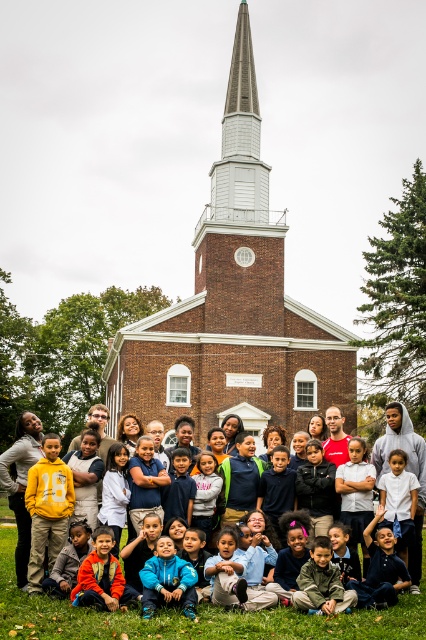
Question: Which object is closer to the camera taking this photo?

Choices:
 (A) brown brick chapel at center
 (B) matte yellow hoodie at center

Answer: (B)

Question: From the image, what is the correct spatial relationship of brown brick chapel at center in relation to matte yellow hoodie at center?

Choices:
 (A) right
 (B) left

Answer: (A)

Question: Does brown brick chapel at center have a greater width compared to matte yellow hoodie at center?

Choices:
 (A) yes
 (B) no

Answer: (B)

Question: Is brown brick chapel at center wider than matte yellow hoodie at center?

Choices:
 (A) no
 (B) yes

Answer: (A)

Question: Among these points, which one is farthest from the camera?

Choices:
 (A) (233, 278)
 (B) (5, 598)

Answer: (A)

Question: Which of the following is the closest to the observer?

Choices:
 (A) brown brick chapel at center
 (B) matte yellow hoodie at center

Answer: (B)